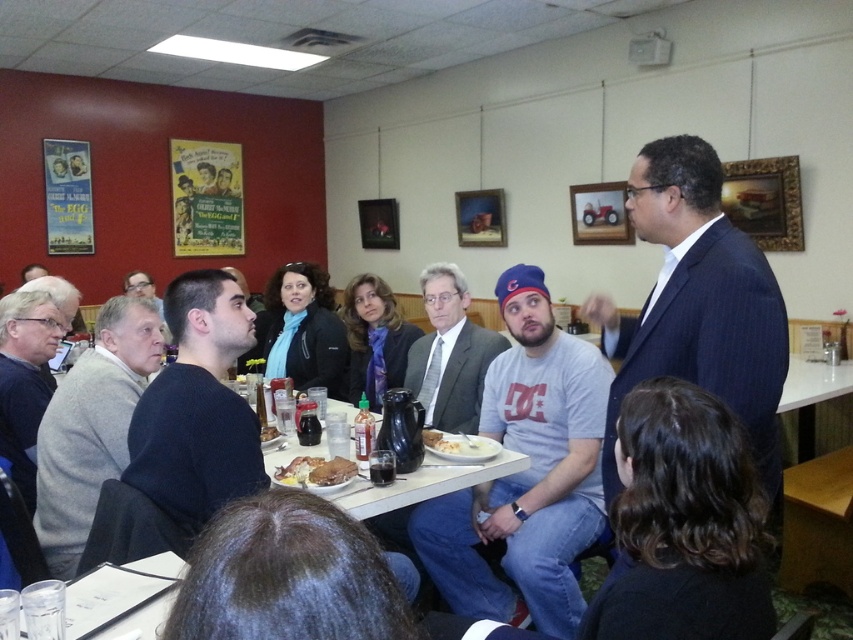
Question: Does white bread at center appear on the left side of matte black jacket at upper center?

Choices:
 (A) no
 (B) yes

Answer: (A)

Question: Which object is the farthest from the gray cotton t-shirt at center?

Choices:
 (A) golden crispy chicken at center
 (B) gray wool sweater at left
 (C) matte black jacket at upper center
 (D) matte gray suit at center

Answer: (C)

Question: Where is matte black jacket at upper center located in relation to golden brown bread at table center in the image?

Choices:
 (A) above
 (B) below

Answer: (A)

Question: Among these objects, which one is farthest from the camera?

Choices:
 (A) dark blue suit at center
 (B) matte black jacket at upper center
 (C) matte gray suit at center

Answer: (B)

Question: Which object is the closest to the dark blue suit at center?

Choices:
 (A) dark blue sweater at center
 (B) matte gray suit at center

Answer: (A)

Question: Where is gray wool sweater at left located in relation to golden brown bread at table center in the image?

Choices:
 (A) below
 (B) above

Answer: (B)